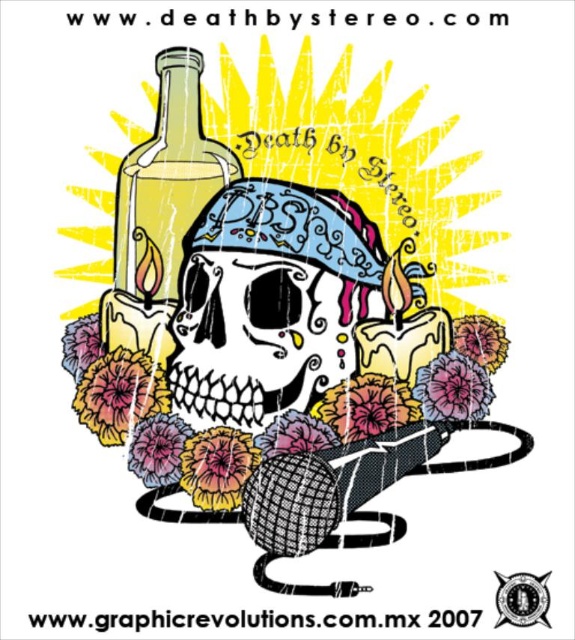
Question: Is black painted skull at center to the left of translucent glass bottle at upper left from the viewer's perspective?

Choices:
 (A) yes
 (B) no

Answer: (B)

Question: Among these objects, which one is nearest to the camera?

Choices:
 (A) black painted skull at center
 (B) translucent glass bottle at upper left

Answer: (B)

Question: Can you confirm if black painted skull at center is wider than translucent glass bottle at upper left?

Choices:
 (A) no
 (B) yes

Answer: (B)

Question: Does black painted skull at center appear on the right side of translucent glass bottle at upper left?

Choices:
 (A) yes
 (B) no

Answer: (A)

Question: Which object is closer to the camera taking this photo?

Choices:
 (A) black painted skull at center
 (B) translucent glass bottle at upper left

Answer: (B)